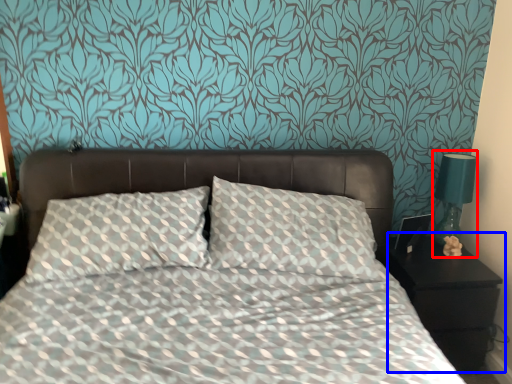
Question: Which object appears farthest to the camera in this image, bedside lamp (highlighted by a red box) or nightstand (highlighted by a blue box)?

Choices:
 (A) bedside lamp
 (B) nightstand

Answer: (A)